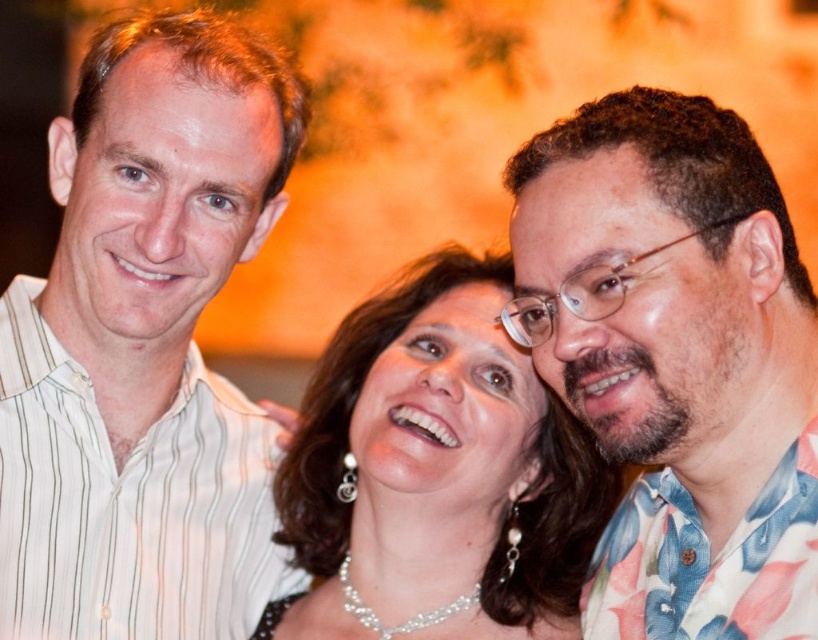
Measure the distance between white striped shirt at left and floral print shirt at center.

A distance of 22.37 inches exists between white striped shirt at left and floral print shirt at center.

Between white striped shirt at left and floral print shirt at center, which one appears on the right side from the viewer's perspective?

Positioned to the right is floral print shirt at center.

Is point (41, 412) closer to camera compared to point (682, 419)?

No, it is behind (682, 419).

This screenshot has height=640, width=818. What are the coordinates of `white striped shirt at left` in the screenshot? It's located at (145, 348).

How much distance is there between floral print shirt at center and pearl necklace at center?

floral print shirt at center and pearl necklace at center are 11.67 inches apart.

Who is more distant from viewer, (630,193) or (520,403)?

Point (520,403)

Image resolution: width=818 pixels, height=640 pixels. What are the coordinates of `floral print shirt at center` in the screenshot? It's located at (677, 360).

Where is `floral print shirt at center`? floral print shirt at center is located at coordinates (677, 360).

Can you confirm if white striped shirt at left is thinner than pearl necklace at center?

Yes.

This screenshot has width=818, height=640. Describe the element at coordinates (145, 348) in the screenshot. I see `white striped shirt at left` at that location.

This screenshot has height=640, width=818. What do you see at coordinates (145, 348) in the screenshot?
I see `white striped shirt at left` at bounding box center [145, 348].

Identify the location of white striped shirt at left. (145, 348).